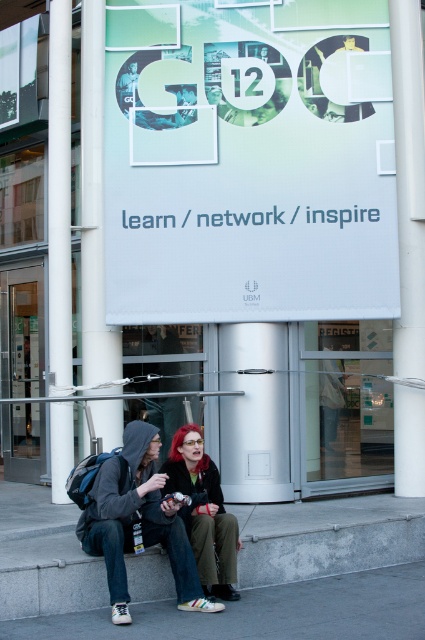
You are standing at the entrance of the building and need to reach the gray concrete stairs at lower center. There is a white smooth pillar at left blocking your path. Can you walk around the pillar to reach the stairs?

The gray concrete stairs at lower center is positioned on the right side of white smooth pillar at left, so you can walk around the white smooth pillar at left to reach the stairs.

You are a photographer at the GDC 12 event. You need to capture a clear photo of the shiny red hair at center without any obstructions. The matte black hoodie at lower left is currently blocking the view. Can you adjust your position to achieve this?

The matte black hoodie at lower left is in front of the shiny red hair at center. To capture a clear photo of the shiny red hair at center without obstruction, you should move your position to the side or behind the matte black hoodie at lower left so it no longer blocks the view.